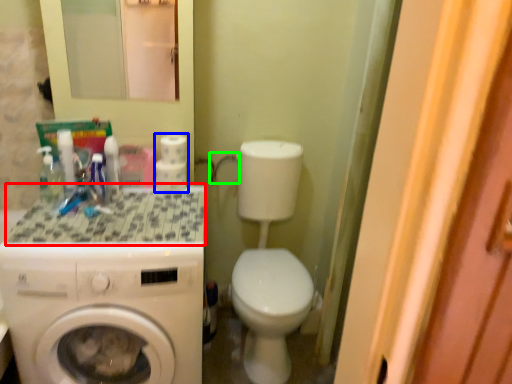
Question: Estimate the real-world distances between objects in this image. Which object is farther from counter top (highlighted by a red box), toilet paper (highlighted by a blue box) or faucet (highlighted by a green box)?

Choices:
 (A) toilet paper
 (B) faucet

Answer: (B)